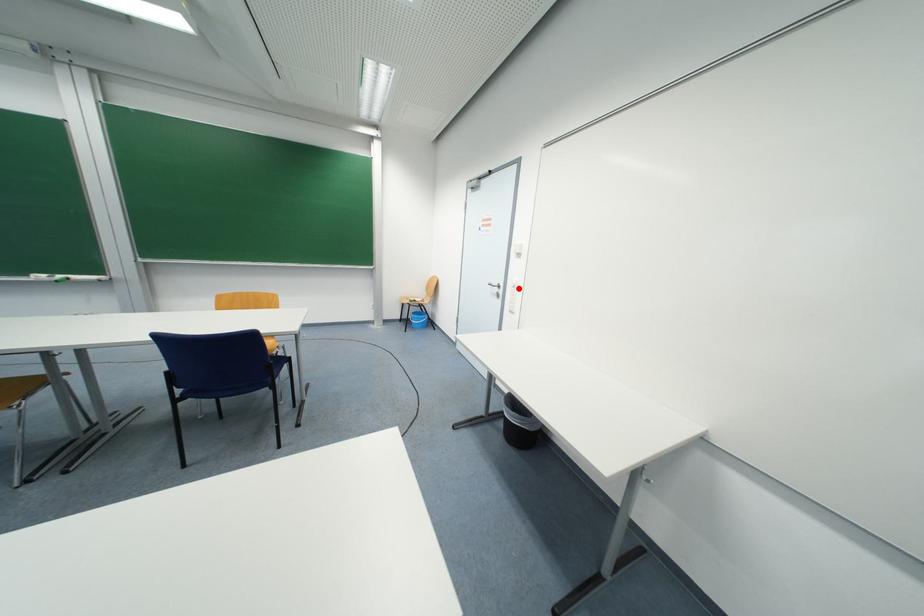
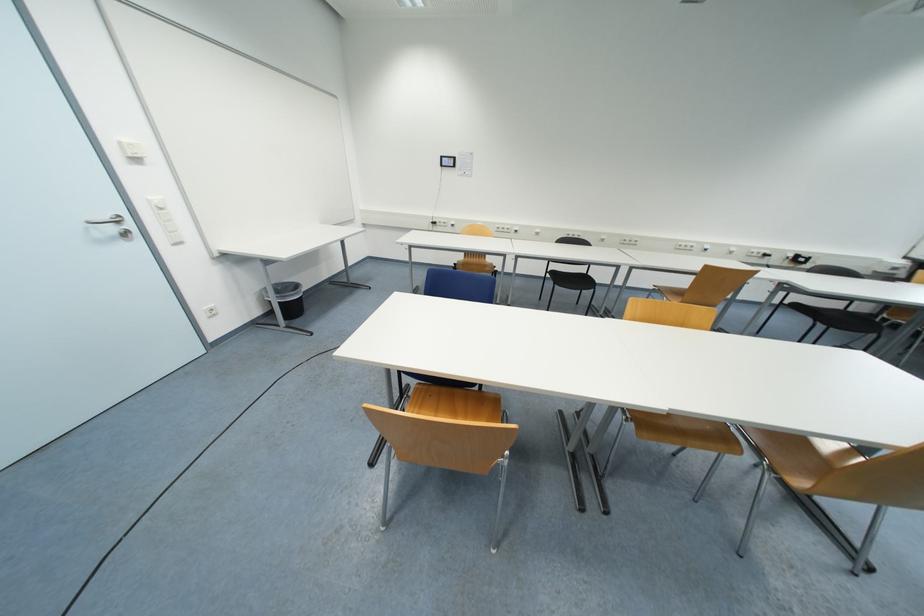
Question: I am providing you with two images of the same scene from different viewpoints. A red point is shown in image1. For the corresponding object point in image2, is it positioned nearer or farther from the camera?

Choices:
 (A) Nearer
 (B) Farther

Answer: (B)